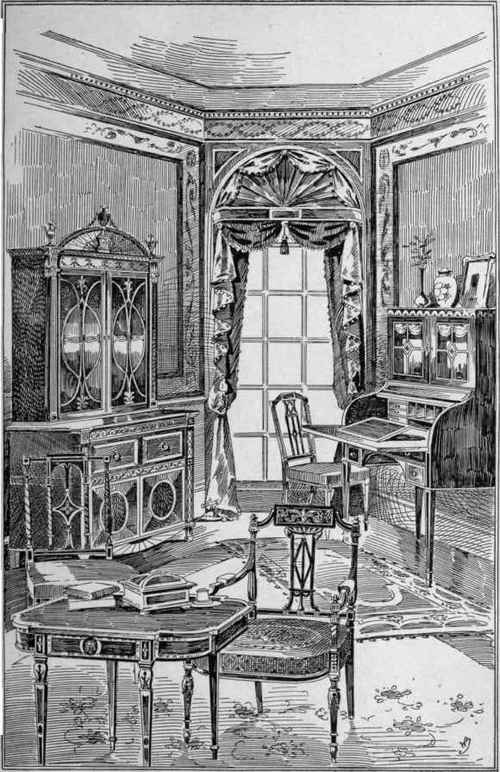
Identify the location of handle of right drawer. (166, 445).